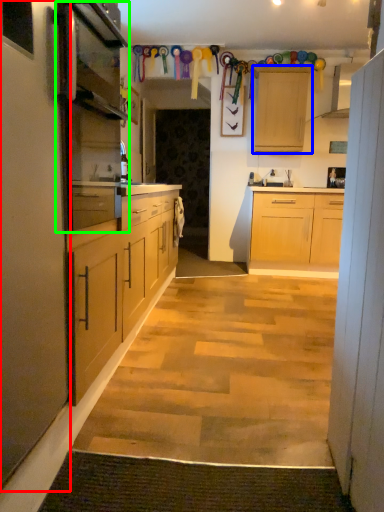
Question: Which is farther away from cabinet (highlighted by a red box)? cabinetry (highlighted by a blue box) or appliance (highlighted by a green box)?

Choices:
 (A) cabinetry
 (B) appliance

Answer: (A)